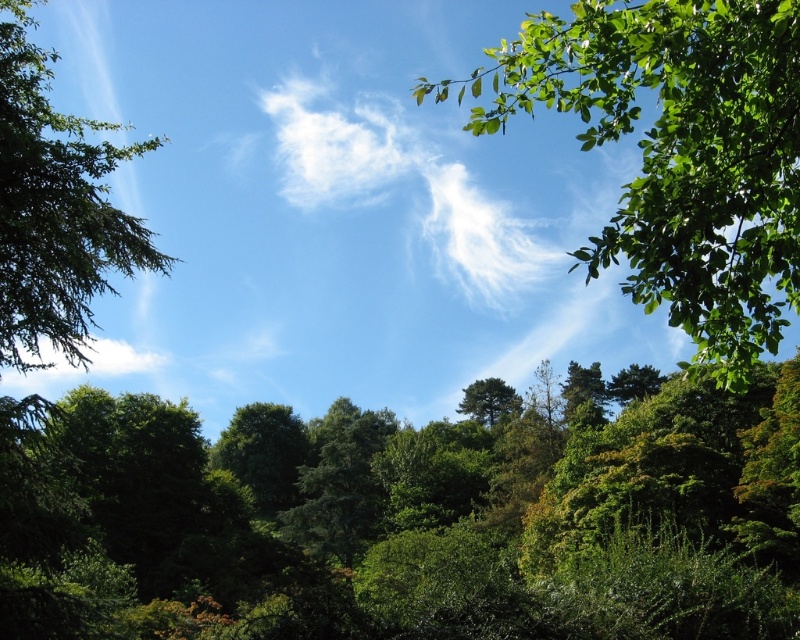
You are a bird flying over the green leafy forest at center and the green leafy branch at upper right. Which one is positioned lower in the image?

The green leafy forest at center is positioned lower than the green leafy branch at upper right.

You are an artist trying to paint the scene. You want to focus on the green leafy forest at center and the green leafy branch at upper right. Which object should you paint first if you want to depict the larger one first?

The green leafy branch at upper right should be painted first because it occupies more space than the green leafy forest at center according to the description.